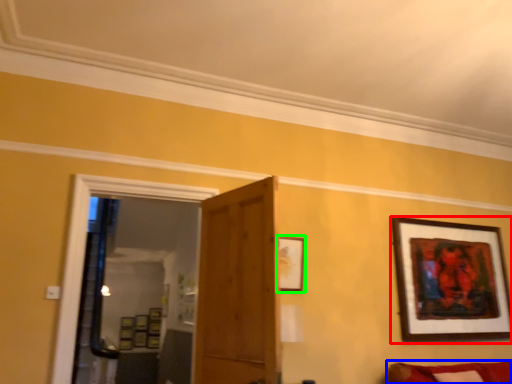
Question: Which object is the closest to the picture frame (highlighted by a red box)? Choose among these: couch (highlighted by a blue box) or picture frame (highlighted by a green box).

Choices:
 (A) couch
 (B) picture frame

Answer: (A)